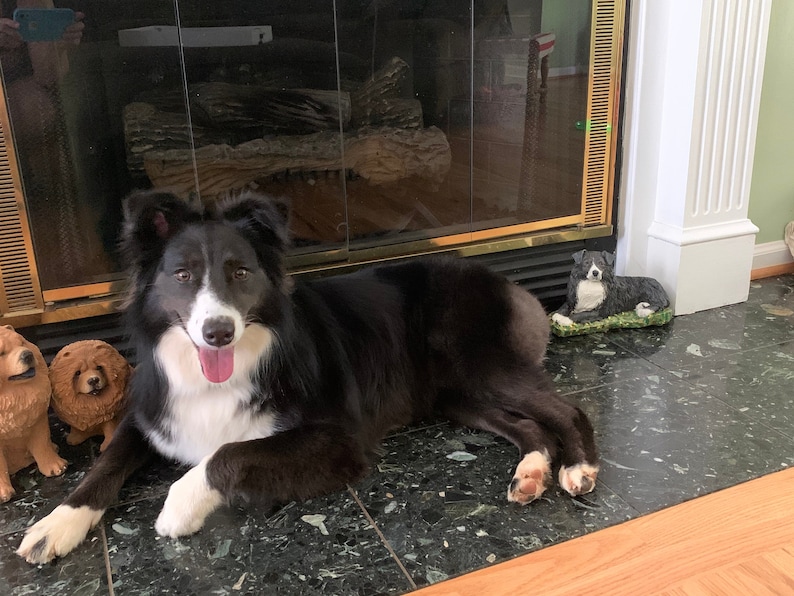
Where is `white chest`? This screenshot has width=794, height=596. white chest is located at coordinates (203, 397).